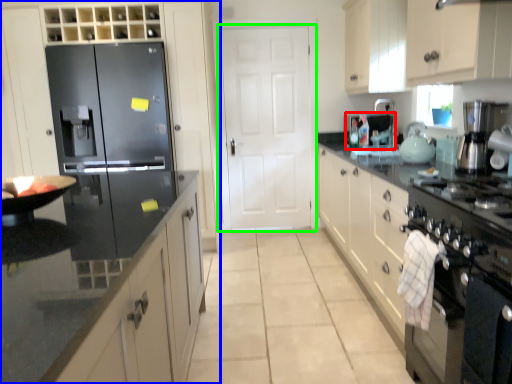
Question: Which object is the closest to the appliance (highlighted by a red box)? Choose among these: cabinetry (highlighted by a blue box) or door (highlighted by a green box).

Choices:
 (A) cabinetry
 (B) door

Answer: (B)